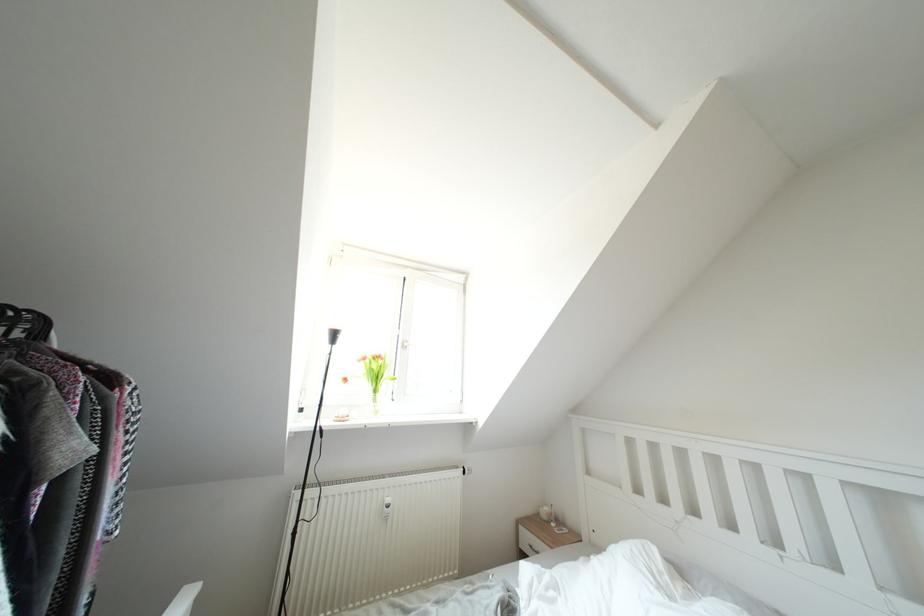
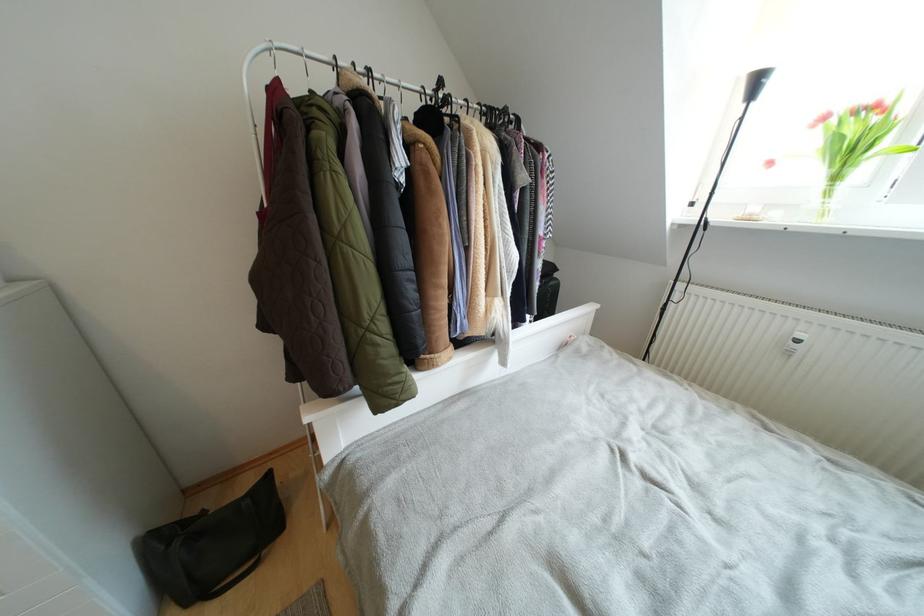
Locate, in the second image, the point that corresponds to pixel 393 504 in the first image.

(805, 339)